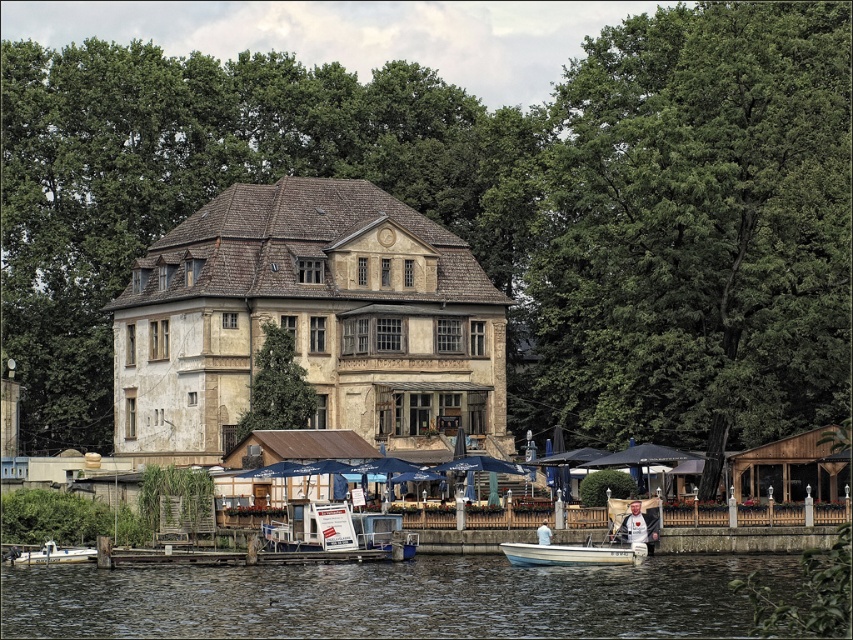
You are a photographer standing at the riverside and want to take a photo of the white plastic boat at lower left without the white cotton shirt at lower center blocking the view. Is the boat currently visible in your frame?

The white plastic boat at lower left is positioned under the white cotton shirt at lower center, so the boat is currently blocked by the shirt and not visible in the frame.

Looking at this image, you are a photographer planning to take a photo of the white plastic boat at lower left and the white cotton shirt at lower center. Since you want both objects to appear similar in size in the final image, which object should you move closer to the camera?

The white plastic boat at lower left is bigger than the white cotton shirt at lower center. To make them appear similar in size in the photo, you should move the white cotton shirt at lower center closer to the camera.

You are a visitor at the riverside and want to take a boat ride. You see the white matte boat at lower center and the white plastic boat at lower left. Which boat is positioned higher from the ground?

The white matte boat at lower center is positioned higher from the ground than the white plastic boat at lower left because it is above it.